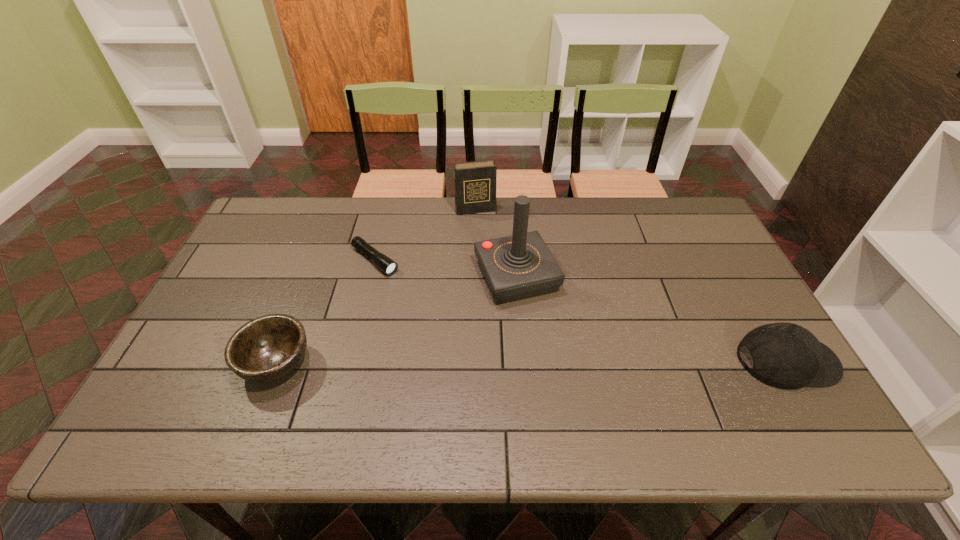
Identify which object is the third closest to the farthest object. Please provide its 2D coordinates. Your answer should be formatted as a tuple, i.e. [(x, y)], where the tuple contains the x and y coordinates of a point satisfying the conditions above.

[(267, 348)]

Where is `free space that satisfies the following two spatial constraints: 1. on the front side of the joystick; 2. on the right side of the flashlight`? This screenshot has height=540, width=960. free space that satisfies the following two spatial constraints: 1. on the front side of the joystick; 2. on the right side of the flashlight is located at coordinates coord(371,276).

The image size is (960, 540). What are the coordinates of `free space that satisfies the following two spatial constraints: 1. on the front side of the flashlight; 2. on the front-facing side of the cap` in the screenshot? It's located at (350, 361).

Locate an element on the screen. The width and height of the screenshot is (960, 540). free location that satisfies the following two spatial constraints: 1. on the front side of the rightmost object; 2. on the front-facing side of the diary is located at coordinates (473, 361).